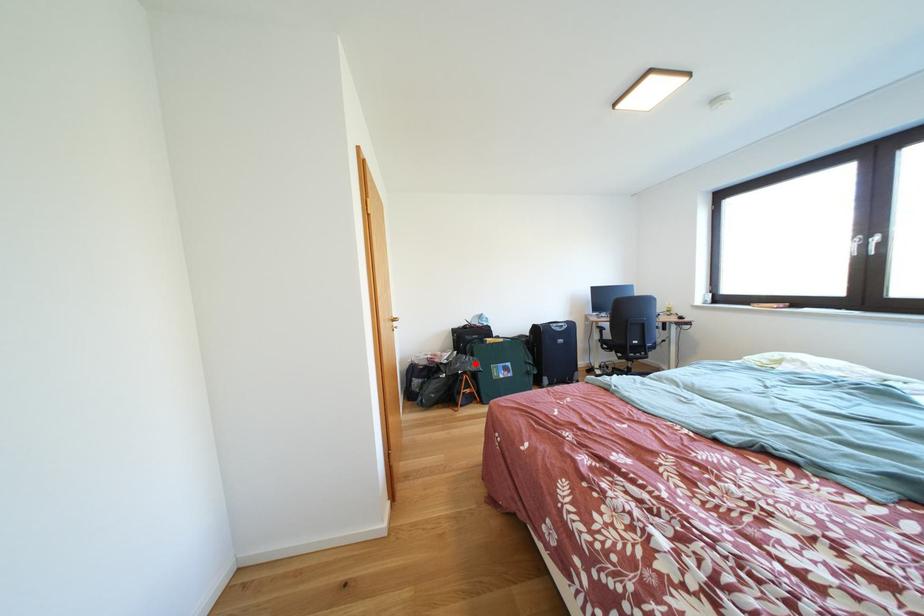
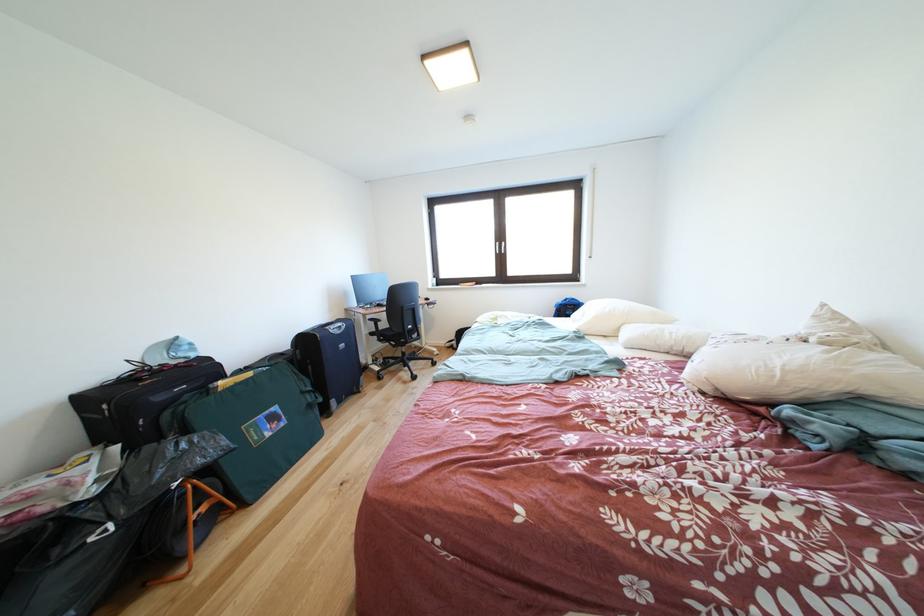
In the second image, find the point that corresponds to the highlighted location in the first image.

(191, 450)